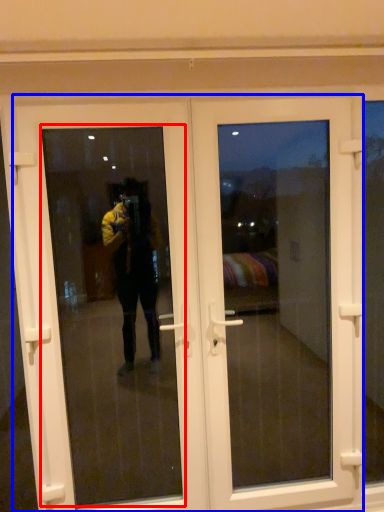
Question: Which object is further to the camera taking this photo, window screen (highlighted by a red box) or door (highlighted by a blue box)?

Choices:
 (A) window screen
 (B) door

Answer: (B)